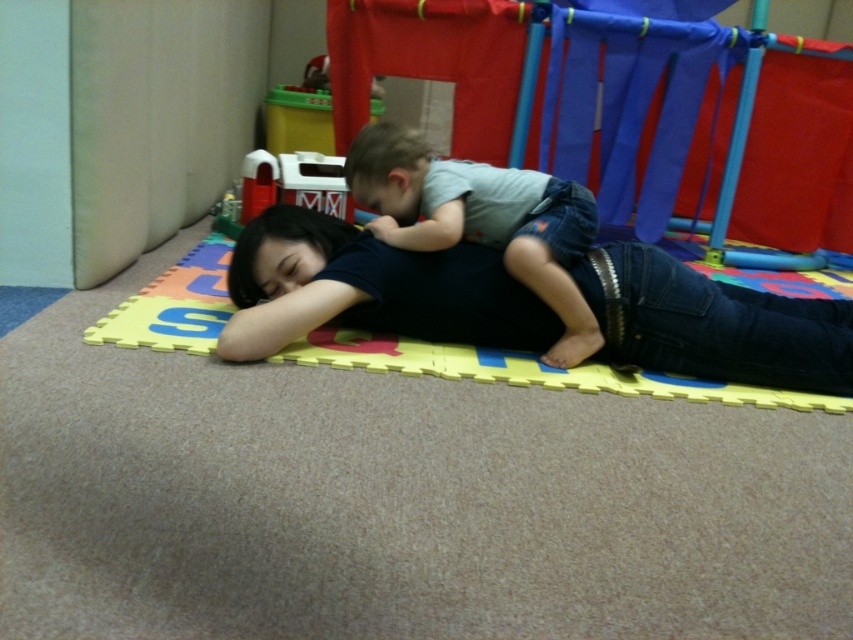
Question: Does yellow foam mat at center lie behind white plastic toy at upper center?

Choices:
 (A) no
 (B) yes

Answer: (A)

Question: From the image, what is the correct spatial relationship of light gray denim pants at center in relation to yellow foam mat at center?

Choices:
 (A) below
 (B) above

Answer: (B)

Question: Which object is closer to the camera taking this photo?

Choices:
 (A) light gray denim pants at center
 (B) white plastic toy at upper center
 (C) yellow foam mat at center

Answer: (C)

Question: Which of the following is the farthest from the observer?

Choices:
 (A) (317, 202)
 (B) (136, 310)
 (C) (378, 150)

Answer: (A)

Question: Observing the image, what is the correct spatial positioning of light gray denim pants at center in reference to white plastic toy at upper center?

Choices:
 (A) left
 (B) right

Answer: (B)

Question: Which is farther from the yellow foam mat at center?

Choices:
 (A) white plastic toy at upper center
 (B) light gray denim pants at center

Answer: (A)